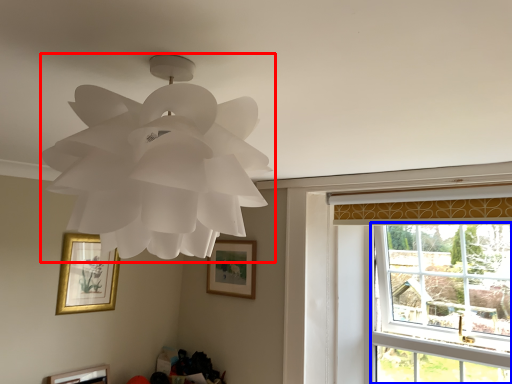
Question: Which object is closer to the camera taking this photo, lamp (highlighted by a red box) or window (highlighted by a blue box)?

Choices:
 (A) lamp
 (B) window

Answer: (A)